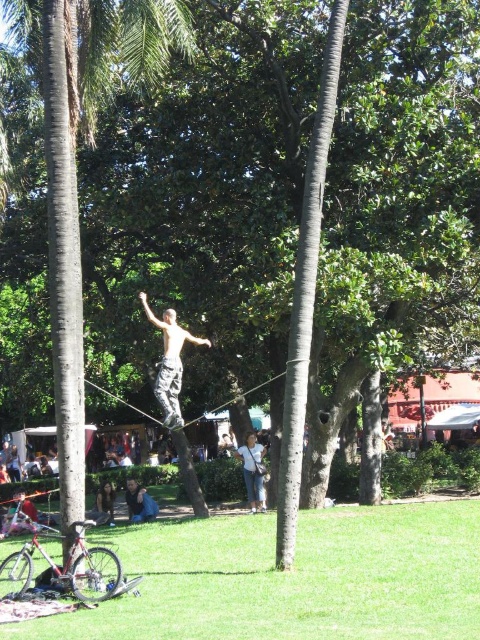
Who is lower down, blue denim jeans at lower left or light brown hair at lower left?

light brown hair at lower left is below.

Is point (141, 509) farther from viewer compared to point (108, 506)?

No, it is in front of (108, 506).

Does point (141, 488) come behind point (105, 499)?

No.

Where is `blue denim jeans at lower left`? This screenshot has width=480, height=640. blue denim jeans at lower left is located at coordinates (140, 502).

Does shiny silver pants at center have a greater width compared to blue denim jeans at lower left?

No, shiny silver pants at center is not wider than blue denim jeans at lower left.

You are a GUI agent. You are given a task and a screenshot of the screen. Output one action in this format:
    pyautogui.click(x=<x>, y=<y>)
    Task: Click on the shiny silver pants at center
    The width and height of the screenshot is (480, 640).
    Given the screenshot: What is the action you would take?
    pyautogui.click(x=169, y=362)

This screenshot has height=640, width=480. Find the location of `shiny silver pants at center`. shiny silver pants at center is located at coordinates (169, 362).

From the picture: Between green textured palm tree at center and denim pants at center, which one has more height?

green textured palm tree at center

Is green textured palm tree at center shorter than denim pants at center?

No, green textured palm tree at center is not shorter than denim pants at center.

At what (x,y) coordinates should I click in order to perform the action: click on green textured palm tree at center. Please return your answer as a coordinate pair (x, y). Looking at the image, I should click on (75, 163).